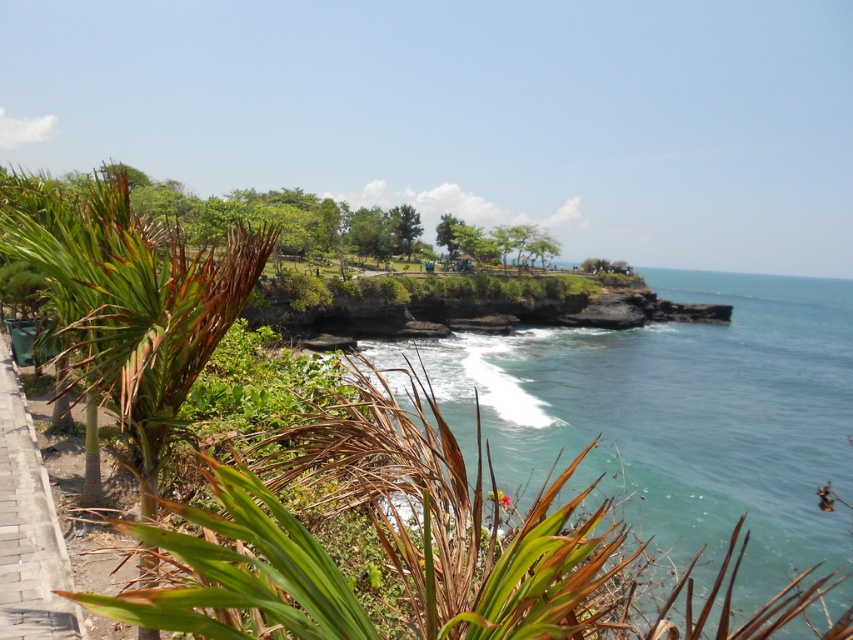
You are a tourist standing on the brick paved path at lower left and want to reach the clear blue water at center. According to the scene, which direction should you move to get there?

The clear blue water at center is located above the brick paved path at lower left, so you should move upward to reach it.

You are standing at the point with coordinates point (x=42, y=611) and want to walk towards the ocean. Is the point point (x=108, y=310) blocking your path?

Point (x=108, y=310) is in front of point (x=42, y=611), so yes, the point point (x=108, y=310) is blocking your path.

You are a hiker standing on the brick paved path at lower left, looking towards the green leafy palm tree at left. Which object is taller?

The green leafy palm tree at left is much taller than the brick paved path at lower left according to the description.